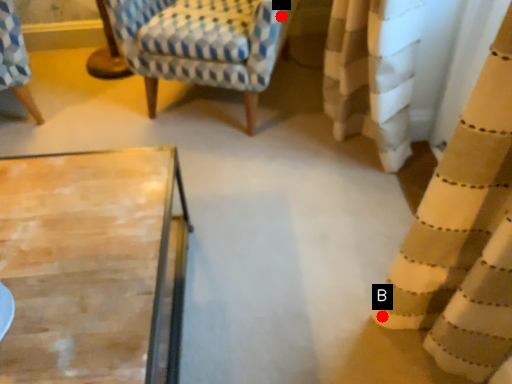
Question: Two points are circled on the image, labeled by A and B beside each circle. Which point appears closest to the camera in this image?

Choices:
 (A) A is closer
 (B) B is closer

Answer: (B)